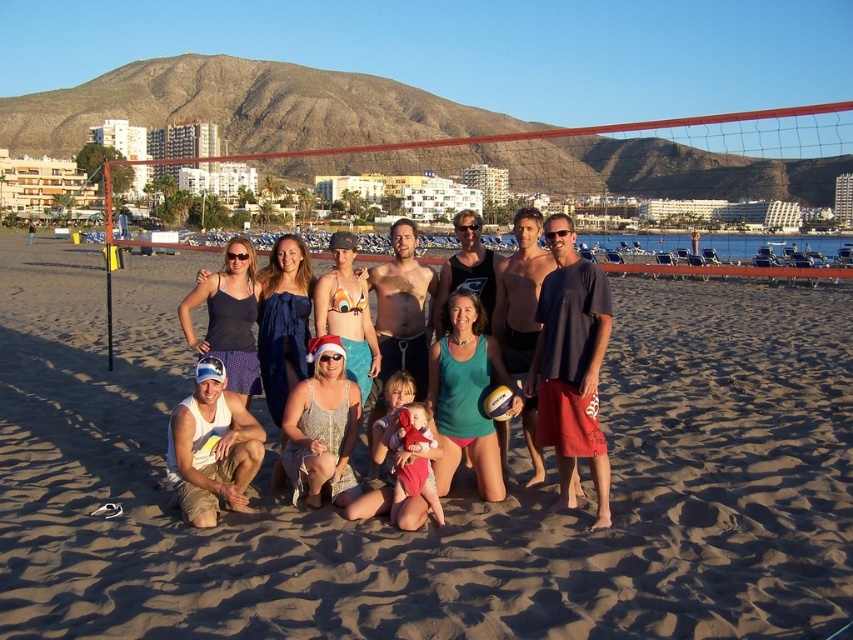
Question: Which point is closer to the camera?

Choices:
 (A) white tank top at lower left
 (B) yellow rubber volleyball at center
 (C) sandy beach at center
 (D) matte black volleyball at center

Answer: (C)

Question: Is sandy beach at center bigger than white tank top at lower left?

Choices:
 (A) yes
 (B) no

Answer: (A)

Question: In this image, where is matte black volleyball at center located relative to white tank top at lower left?

Choices:
 (A) above
 (B) below

Answer: (A)

Question: Which point appears farthest from the camera in this image?

Choices:
 (A) (849, 300)
 (B) (598, 508)
 (C) (489, 413)
 (D) (225, 435)

Answer: (A)

Question: Among these points, which one is farthest from the camera?

Choices:
 (A) (216, 381)
 (B) (498, 410)

Answer: (B)

Question: Does sandy beach at center appear on the right side of white tank top at lower left?

Choices:
 (A) yes
 (B) no

Answer: (A)